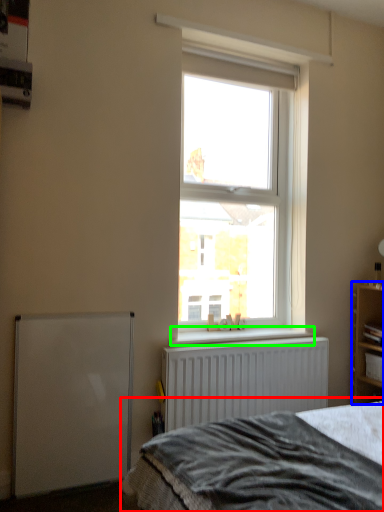
Question: Which object is positioned closest to bed (highlighted by a red box)? Select from shelf (highlighted by a blue box) and window sill (highlighted by a green box).

Choices:
 (A) shelf
 (B) window sill

Answer: (B)